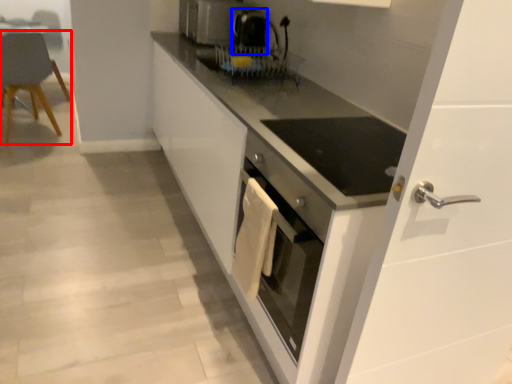
Question: Which of the following is the closest to the observer, chair (highlighted by a red box) or coffee machine (highlighted by a blue box)?

Choices:
 (A) chair
 (B) coffee machine

Answer: (B)